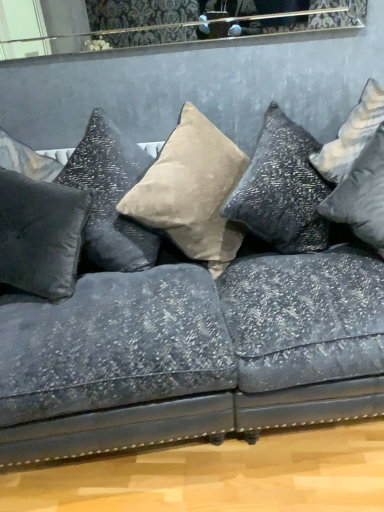
Question: From the image's perspective, is suede beige pillow at center, which is counted as the third pillow, starting from the left, above or below silver metallic pillow at right, which is counted as the fourth pillow, starting from the left?

Choices:
 (A) below
 (B) above

Answer: (B)

Question: From their relative heights in the image, would you say suede beige pillow at center, which appears as the 2th pillow when viewed from the right, is taller or shorter than silver metallic pillow at right, which appears as the 1th pillow when viewed from the right?

Choices:
 (A) short
 (B) tall

Answer: (B)

Question: Which object is the closest to the suede beige pillow at center, which appears as the 2th pillow when viewed from the right?

Choices:
 (A) satin black pillow at center, the 2th pillow when ordered from left to right
 (B) silver metallic pillow at right, which is counted as the fourth pillow, starting from the left
 (C) satin black pillow at left, which is counted as the first pillow, starting from the left

Answer: (A)

Question: Considering the real-world distances, which object is farthest from the silver metallic pillow at right, which is counted as the fourth pillow, starting from the left?

Choices:
 (A) satin black pillow at center, the 2th pillow when ordered from left to right
 (B) satin black pillow at left, the fourth pillow in the right-to-left sequence
 (C) suede beige pillow at center, which appears as the 2th pillow when viewed from the right

Answer: (B)